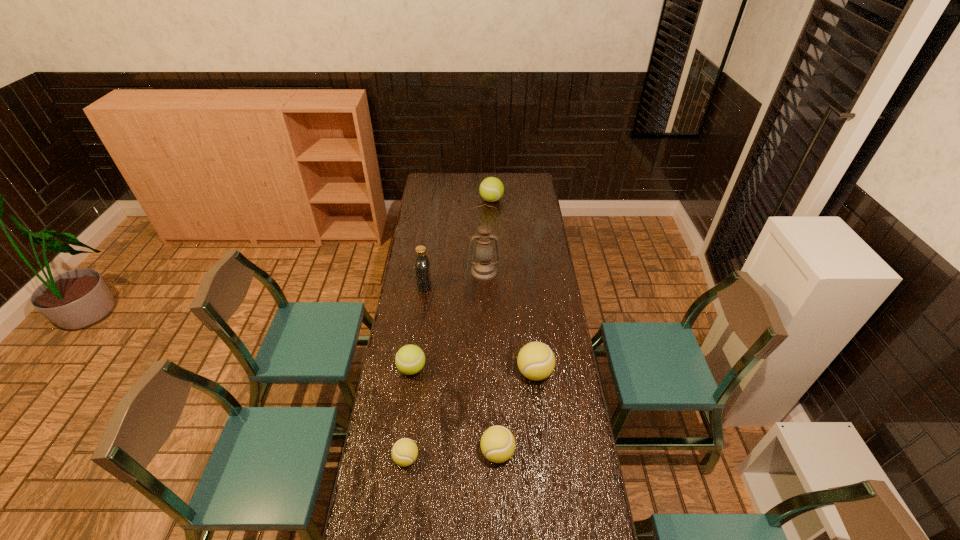
Identify the location of green tennis ball that stands as the closest to the leftmost yellow tennis ball. The height and width of the screenshot is (540, 960). (410, 359).

Where is `free location that satisfies the following two spatial constraints: 1. on the back side of the smallest yellow tennis ball; 2. on the front-facing side of the vodka`? The width and height of the screenshot is (960, 540). free location that satisfies the following two spatial constraints: 1. on the back side of the smallest yellow tennis ball; 2. on the front-facing side of the vodka is located at coordinates tap(428, 285).

Where is `vacant space that satisfies the following two spatial constraints: 1. on the front side of the second yellow tennis ball from right to left; 2. on the right side of the left green tennis ball`? The width and height of the screenshot is (960, 540). vacant space that satisfies the following two spatial constraints: 1. on the front side of the second yellow tennis ball from right to left; 2. on the right side of the left green tennis ball is located at coordinates (400, 453).

Image resolution: width=960 pixels, height=540 pixels. I want to click on vacant space that satisfies the following two spatial constraints: 1. on the back side of the oil lamp; 2. on the left side of the shortest object, so click(429, 271).